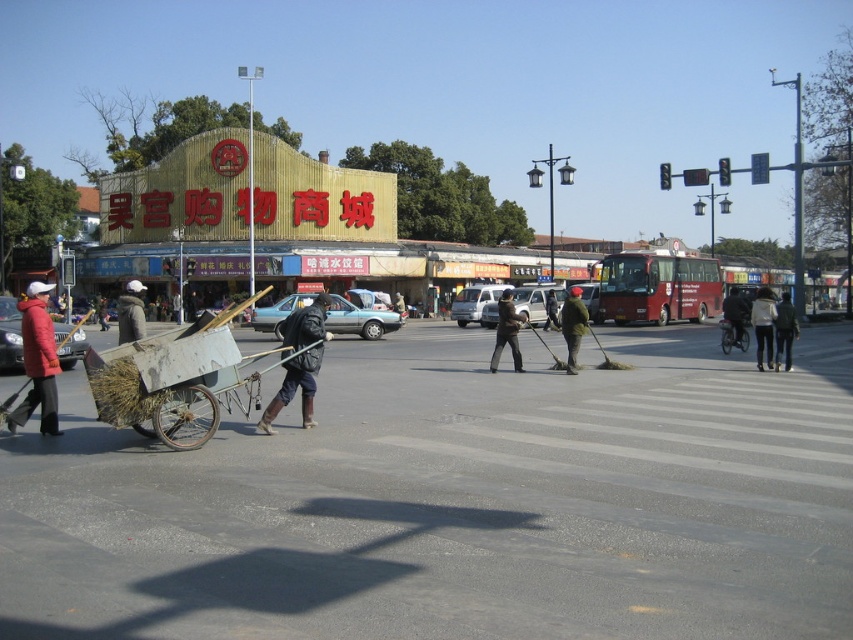
Question: Is matte red coat at lower left to the right of dark gray fabric jacket at center-left from the viewer's perspective?

Choices:
 (A) yes
 (B) no

Answer: (B)

Question: Estimate the real-world distances between objects in this image. Which object is closer to the matte red coat at lower left?

Choices:
 (A) dark green uniform at center
 (B) dark gray jacket at center

Answer: (B)

Question: Which of the following is the farthest from the observer?

Choices:
 (A) dark brown leather jacket at center
 (B) black leather jacket at center
 (C) dark gray jacket at center

Answer: (C)

Question: Considering the relative positions of dark green jacket at center and dark gray fabric jacket at center-left in the image provided, where is dark green jacket at center located with respect to dark gray fabric jacket at center-left?

Choices:
 (A) right
 (B) left

Answer: (A)

Question: Which is nearer to the matte red coat at lower left?

Choices:
 (A) dark blue jacket at center
 (B) black leather jacket at center

Answer: (B)

Question: Is black leather jacket at center closer to the viewer compared to dark green uniform at center?

Choices:
 (A) yes
 (B) no

Answer: (A)